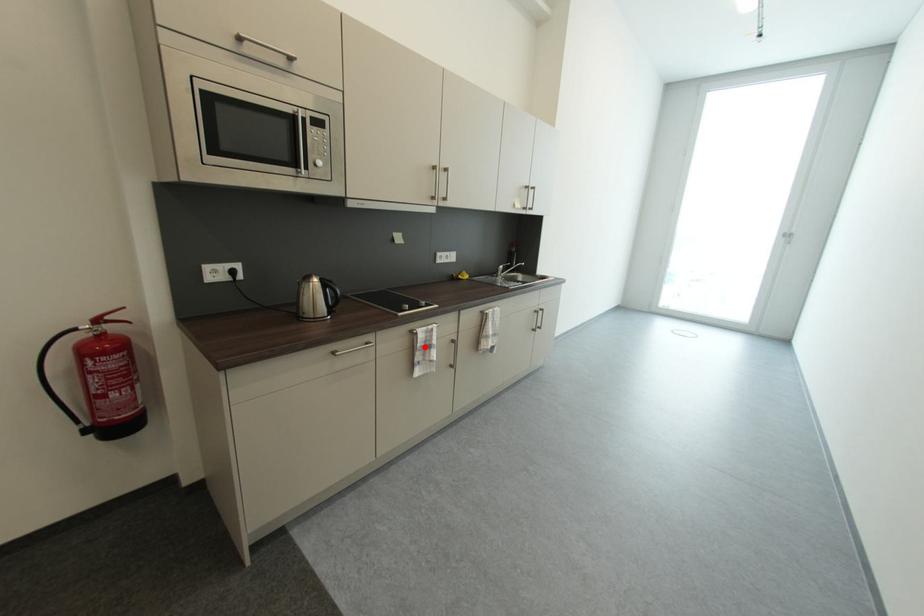
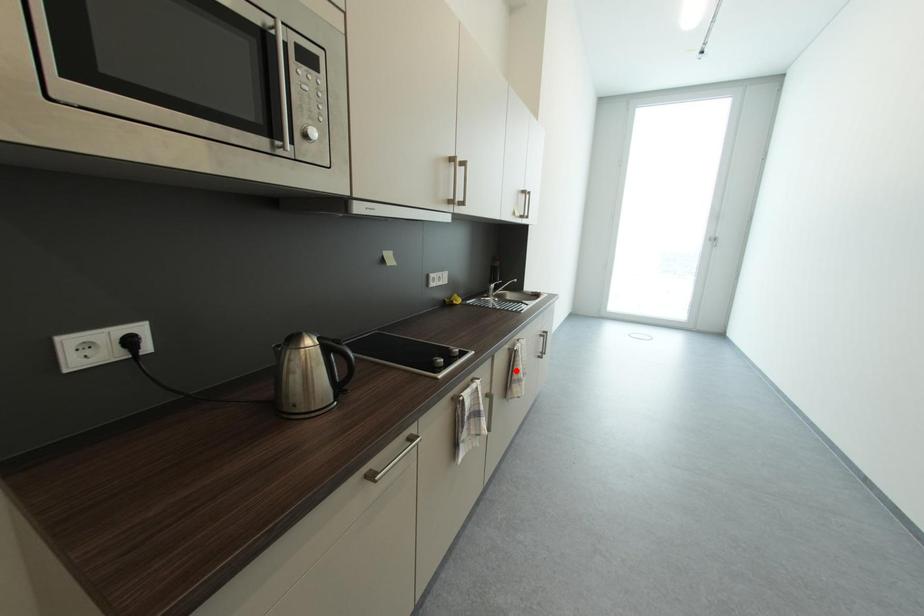
I am providing you with two images of the same scene from different viewpoints. A red point is marked on the first image and another point is marked on the second image. Is the red point in image1 aligned with the point shown in image2?

No